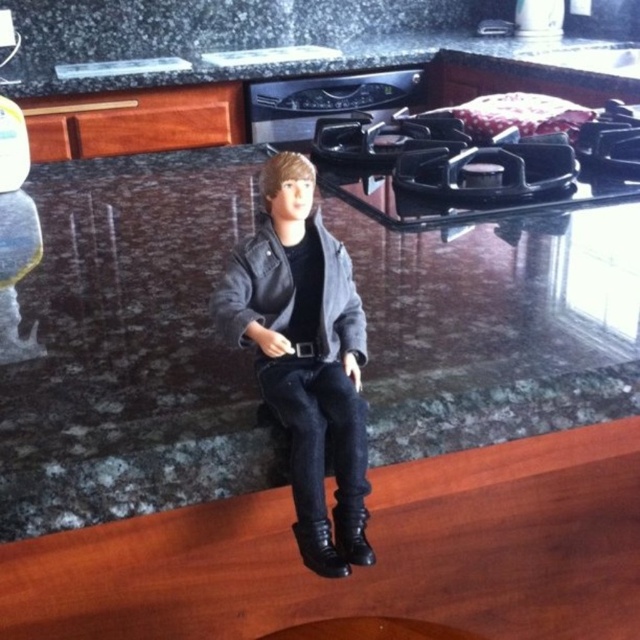
Which is behind, point (128, 52) or point (259, 272)?

Positioned behind is point (128, 52).

The image size is (640, 640). What do you see at coordinates (300, 42) in the screenshot? I see `granite countertop at upper center` at bounding box center [300, 42].

Where is `granite countertop at upper center`? granite countertop at upper center is located at coordinates (300, 42).